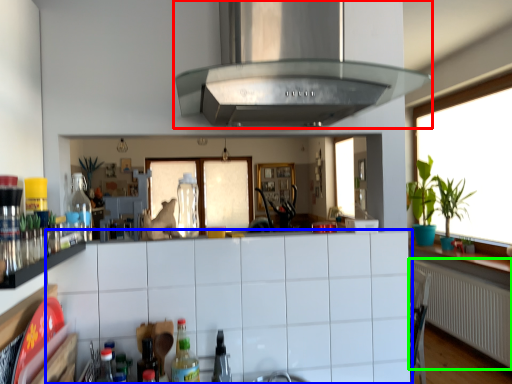
Question: Which object is positioned closest to exhaust hood (highlighted by a red box)? Select from cabinetry (highlighted by a blue box) and radiator (highlighted by a green box).

Choices:
 (A) cabinetry
 (B) radiator

Answer: (A)